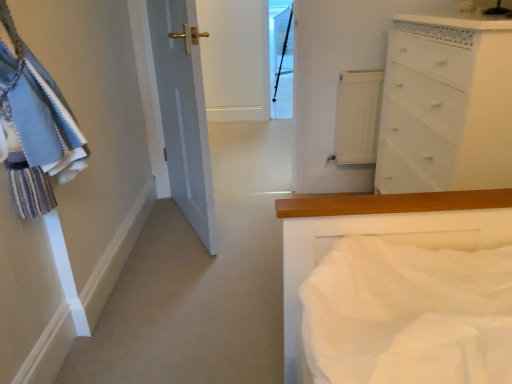
Question: Can you confirm if white wood radiator at upper center is smaller than white painted wood chest of drawers at upper right?

Choices:
 (A) no
 (B) yes

Answer: (B)

Question: Is white wood radiator at upper center outside white painted wood chest of drawers at upper right?

Choices:
 (A) yes
 (B) no

Answer: (A)

Question: Can white painted wood chest of drawers at upper right be found inside white wood radiator at upper center?

Choices:
 (A) no
 (B) yes

Answer: (A)

Question: From the image's perspective, is white wood radiator at upper center located beneath white painted wood chest of drawers at upper right?

Choices:
 (A) no
 (B) yes

Answer: (A)

Question: Are white wood radiator at upper center and white painted wood chest of drawers at upper right making contact?

Choices:
 (A) no
 (B) yes

Answer: (A)

Question: Is white wood radiator at upper center taller than white painted wood chest of drawers at upper right?

Choices:
 (A) yes
 (B) no

Answer: (B)

Question: From the image's perspective, does white wood radiator at upper center appear lower than transparent glass door at upper center?

Choices:
 (A) no
 (B) yes

Answer: (B)

Question: Is white wood radiator at upper center facing away from transparent glass door at upper center?

Choices:
 (A) no
 (B) yes

Answer: (B)

Question: Considering the relative positions of white wood radiator at upper center and transparent glass door at upper center in the image provided, is white wood radiator at upper center to the right of transparent glass door at upper center from the viewer's perspective?

Choices:
 (A) yes
 (B) no

Answer: (A)

Question: Can you confirm if white wood radiator at upper center is shorter than transparent glass door at upper center?

Choices:
 (A) yes
 (B) no

Answer: (A)

Question: From a real-world perspective, is white wood radiator at upper center on top of transparent glass door at upper center?

Choices:
 (A) no
 (B) yes

Answer: (A)

Question: Would you say transparent glass door at upper center is part of white wood radiator at upper center's contents?

Choices:
 (A) yes
 (B) no

Answer: (B)

Question: Is transparent glass door at upper center bigger than white painted wood chest of drawers at upper right?

Choices:
 (A) no
 (B) yes

Answer: (A)